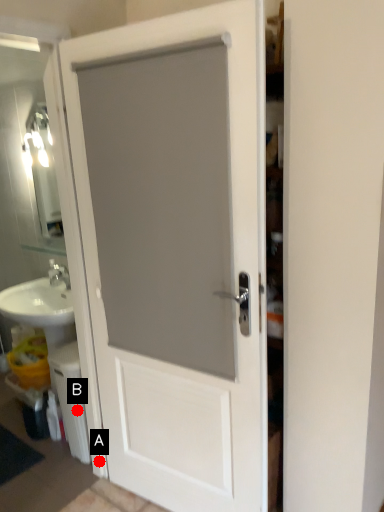
Question: Two points are circled on the image, labeled by A and B beside each circle. Which point appears closest to the camera in this image?

Choices:
 (A) A is closer
 (B) B is closer

Answer: (A)